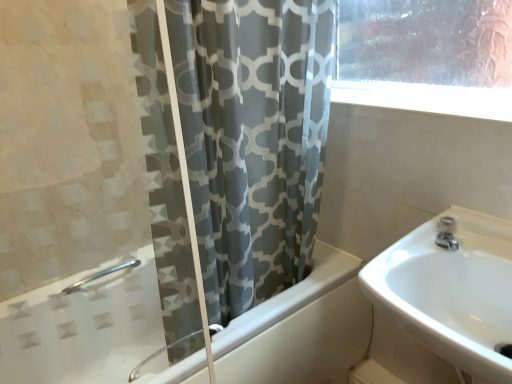
Question: Should I look upward or downward to see satin nickel faucet at upper right?

Choices:
 (A) up
 (B) down

Answer: (B)

Question: From the image's perspective, would you say white glossy bathtub at center is shown under satin nickel faucet at upper right?

Choices:
 (A) yes
 (B) no

Answer: (A)

Question: Is white glossy bathtub at center further to camera compared to satin nickel faucet at upper right?

Choices:
 (A) yes
 (B) no

Answer: (B)

Question: From a real-world perspective, is white glossy bathtub at center physically below satin nickel faucet at upper right?

Choices:
 (A) no
 (B) yes

Answer: (B)

Question: Does white glossy bathtub at center appear on the left side of satin nickel faucet at upper right?

Choices:
 (A) yes
 (B) no

Answer: (A)

Question: Is white glossy bathtub at center bigger than satin nickel faucet at upper right?

Choices:
 (A) no
 (B) yes

Answer: (B)

Question: Is white glossy bathtub at center not within satin nickel faucet at upper right?

Choices:
 (A) yes
 (B) no

Answer: (A)

Question: Considering the relative sizes of white glossy sink at right and white glossy bathtub at center in the image provided, is white glossy sink at right taller than white glossy bathtub at center?

Choices:
 (A) no
 (B) yes

Answer: (A)

Question: Is white glossy sink at right facing away from white glossy bathtub at center?

Choices:
 (A) yes
 (B) no

Answer: (B)

Question: Is white glossy sink at right not within white glossy bathtub at center?

Choices:
 (A) no
 (B) yes

Answer: (B)

Question: Is white glossy sink at right further to camera compared to white glossy bathtub at center?

Choices:
 (A) no
 (B) yes

Answer: (A)

Question: Does white glossy sink at right contain white glossy bathtub at center?

Choices:
 (A) no
 (B) yes

Answer: (A)

Question: Are white glossy sink at right and white glossy bathtub at center beside each other?

Choices:
 (A) no
 (B) yes

Answer: (A)

Question: Can you confirm if satin nickel faucet at upper right is thinner than white glossy bathtub at center?

Choices:
 (A) no
 (B) yes

Answer: (B)